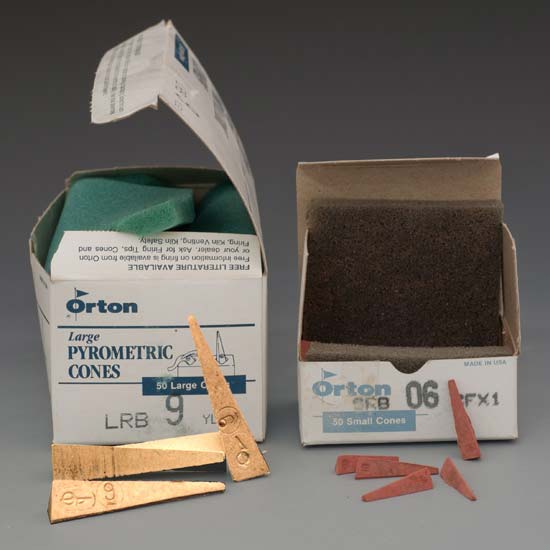
The height and width of the screenshot is (550, 550). In order to click on pennant in this screenshot , I will do `click(326, 375)`, `click(84, 294)`.